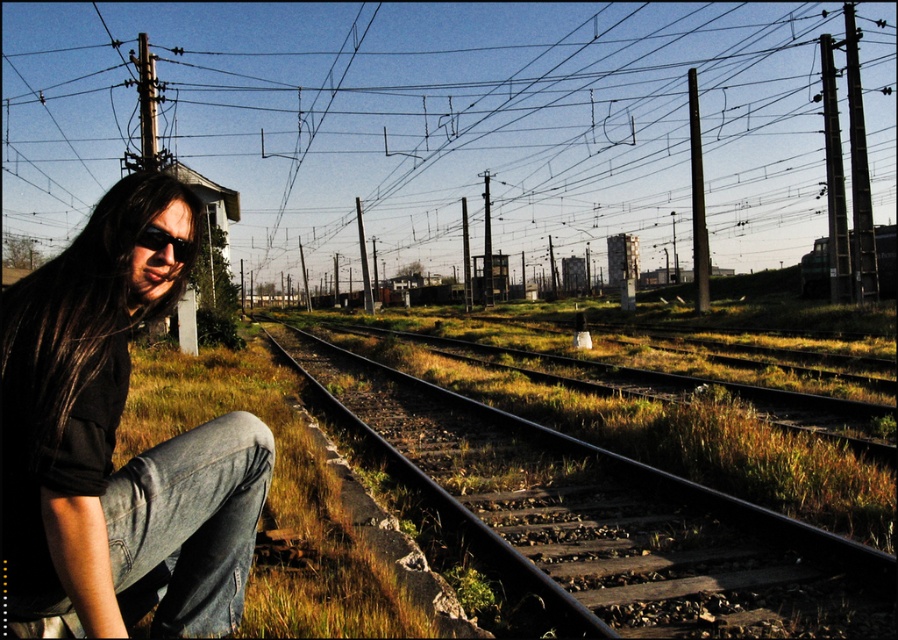
Is metal/smooth train track at center bigger than brown matte hair at left?

Yes.

Is point (856, 557) less distant than point (104, 236)?

That is False.

Where is `metal/smooth train track at center`? The image size is (898, 640). metal/smooth train track at center is located at coordinates (613, 516).

Does metallic wire at upper center have a lesser height compared to black matte sunglasses at left?

No.

Which is in front, point (492, 58) or point (148, 228)?

Point (148, 228)

Image resolution: width=898 pixels, height=640 pixels. I want to click on metallic wire at upper center, so click(432, 124).

Which is in front, point (502, 152) or point (595, 508)?

Positioned in front is point (595, 508).

Is metallic wire at upper center smaller than metal/smooth train track at center?

No.

You are a GUI agent. You are given a task and a screenshot of the screen. Output one action in this format:
    pyautogui.click(x=<x>, y=<y>)
    Task: Click on the metallic wire at upper center
    The width and height of the screenshot is (898, 640).
    Given the screenshot: What is the action you would take?
    pyautogui.click(x=432, y=124)